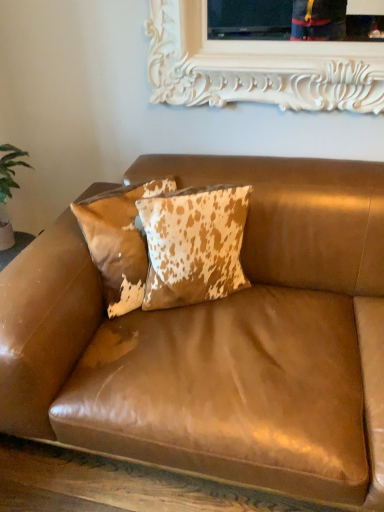
Question: Is cowhide pillow at center, the first pillow in the left-to-right sequence, looking in the opposite direction of cowhide pillow at center, which is the 1th pillow from right to left?

Choices:
 (A) yes
 (B) no

Answer: (B)

Question: From a real-world perspective, is cowhide pillow at center, positioned as the second pillow in right-to-left order, under cowhide pillow at center, which is the 1th pillow from right to left?

Choices:
 (A) yes
 (B) no

Answer: (A)

Question: Considering the relative positions of cowhide pillow at center, positioned as the second pillow in right-to-left order, and cowhide pillow at center, the second pillow viewed from the left, in the image provided, is cowhide pillow at center, positioned as the second pillow in right-to-left order, to the right of cowhide pillow at center, the second pillow viewed from the left, from the viewer's perspective?

Choices:
 (A) yes
 (B) no

Answer: (B)

Question: Is cowhide pillow at center, positioned as the second pillow in right-to-left order, positioned before cowhide pillow at center, which is the 1th pillow from right to left?

Choices:
 (A) yes
 (B) no

Answer: (B)

Question: From the image's perspective, would you say cowhide pillow at center, positioned as the second pillow in right-to-left order, is positioned over cowhide pillow at center, which is the 1th pillow from right to left?

Choices:
 (A) yes
 (B) no

Answer: (A)

Question: Considering the positions of brown leather couch at center and cowhide pillow at center, the second pillow viewed from the left, in the image, is brown leather couch at center bigger or smaller than cowhide pillow at center, the second pillow viewed from the left,?

Choices:
 (A) small
 (B) big

Answer: (B)

Question: Is point (233, 308) positioned closer to the camera than point (195, 219)?

Choices:
 (A) closer
 (B) farther

Answer: (B)

Question: Based on their positions, is brown leather couch at center located to the left or right of cowhide pillow at center, the second pillow viewed from the left?

Choices:
 (A) left
 (B) right

Answer: (B)

Question: From a real-world perspective, is brown leather couch at center above or below cowhide pillow at center, the second pillow viewed from the left?

Choices:
 (A) below
 (B) above

Answer: (A)

Question: In the image, is cowhide pillow at center, positioned as the second pillow in right-to-left order, positioned in front of or behind cowhide pillow at center, the second pillow viewed from the left?

Choices:
 (A) behind
 (B) front

Answer: (A)

Question: From a real-world perspective, is cowhide pillow at center, positioned as the second pillow in right-to-left order, positioned above or below cowhide pillow at center, which is the 1th pillow from right to left?

Choices:
 (A) above
 (B) below

Answer: (B)

Question: Considering the relative positions of cowhide pillow at center, the first pillow in the left-to-right sequence, and cowhide pillow at center, which is the 1th pillow from right to left, in the image provided, is cowhide pillow at center, the first pillow in the left-to-right sequence, to the left or to the right of cowhide pillow at center, which is the 1th pillow from right to left,?

Choices:
 (A) left
 (B) right

Answer: (A)

Question: Based on their sizes in the image, would you say cowhide pillow at center, the first pillow in the left-to-right sequence, is bigger or smaller than cowhide pillow at center, the second pillow viewed from the left?

Choices:
 (A) small
 (B) big

Answer: (B)

Question: From a real-world perspective, relative to cowhide pillow at center, positioned as the second pillow in right-to-left order, is brown leather couch at center vertically above or below?

Choices:
 (A) below
 (B) above

Answer: (A)

Question: Which is correct: brown leather couch at center is inside cowhide pillow at center, positioned as the second pillow in right-to-left order, or outside of it?

Choices:
 (A) outside
 (B) inside

Answer: (A)